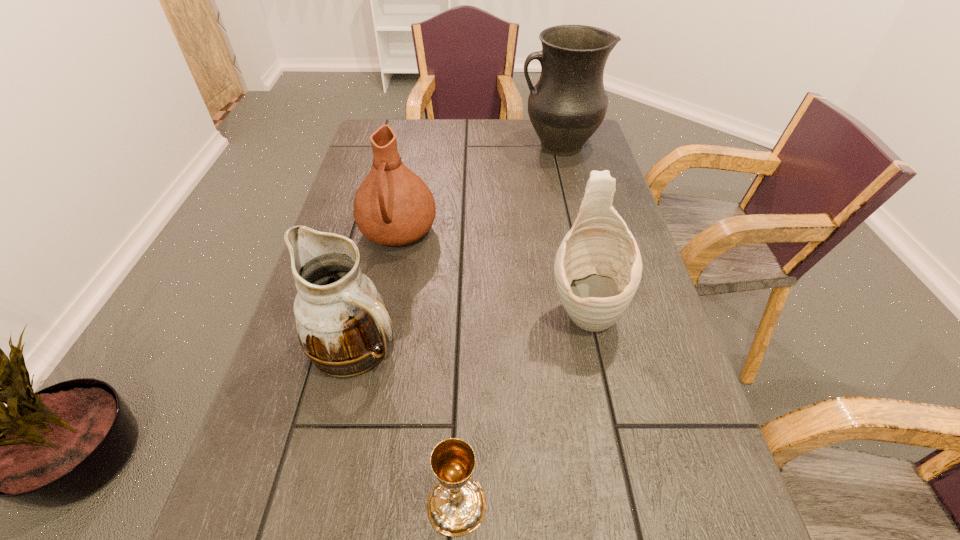
In order to click on object that stands as the fourth closest to the second farthest pitcher in this screenshot , I will do `click(456, 506)`.

Identify which object is the closest to the nearest object. Please provide its 2D coordinates. Your answer should be formatted as a tuple, i.e. [(x, y)], where the tuple contains the x and y coordinates of a point satisfying the conditions above.

[(343, 326)]

Image resolution: width=960 pixels, height=540 pixels. Find the location of `the third closest pitcher to the farthest pitcher`. the third closest pitcher to the farthest pitcher is located at coordinates (343, 326).

Choose which pitcher is the second nearest neighbor to the farthest object. Please provide its 2D coordinates. Your answer should be formatted as a tuple, i.e. [(x, y)], where the tuple contains the x and y coordinates of a point satisfying the conditions above.

[(598, 267)]

Where is `vacant space that satisfies the following two spatial constraints: 1. on the handle side of the farthest object; 2. on the side of the second farthest pitcher with the handle`? The height and width of the screenshot is (540, 960). vacant space that satisfies the following two spatial constraints: 1. on the handle side of the farthest object; 2. on the side of the second farthest pitcher with the handle is located at coordinates (579, 233).

This screenshot has width=960, height=540. I want to click on vacant space that satisfies the following two spatial constraints: 1. on the side of the chalice with the handle; 2. on the right side of the second farthest pitcher, so click(x=345, y=504).

Find the location of a particular element. This screenshot has width=960, height=540. vacant space that satisfies the following two spatial constraints: 1. on the handle side of the farthest pitcher; 2. on the side of the fourth nearest object with the handle is located at coordinates (579, 233).

The height and width of the screenshot is (540, 960). In order to click on vacant space that satisfies the following two spatial constraints: 1. on the handle side of the farthest object; 2. on the side of the second farthest pitcher with the handle in this screenshot , I will do [579, 233].